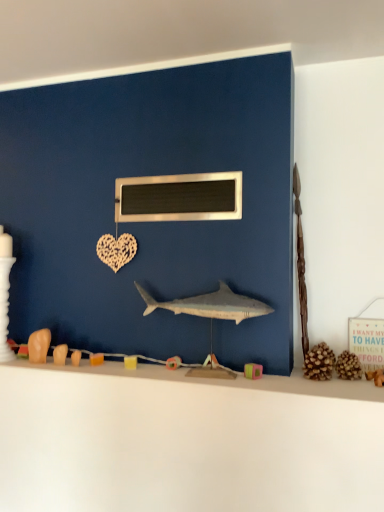
Find the location of `free area below smooth gray shark at center (from a real-world perspective)`. free area below smooth gray shark at center (from a real-world perspective) is located at coordinates (198, 371).